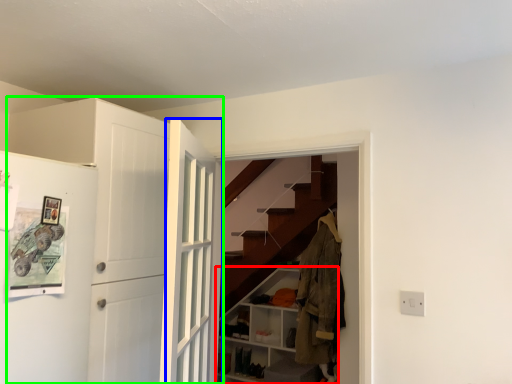
Question: Which is nearer to the cabinetry (highlighted by a red box)? door (highlighted by a blue box) or door (highlighted by a green box).

Choices:
 (A) door
 (B) door

Answer: (A)